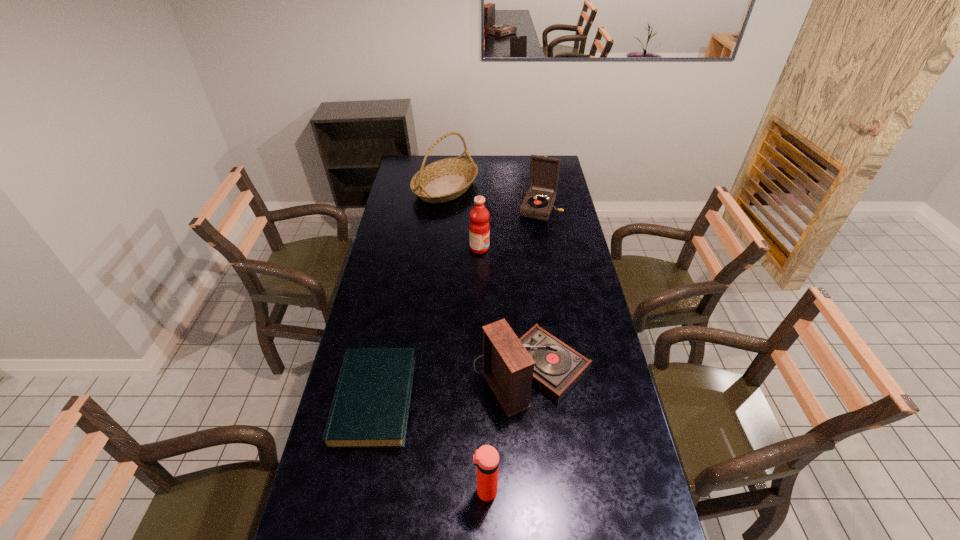
What are the coordinates of `unoccupied position between the fruit juice and the farther phonograph record` in the screenshot? It's located at (510, 228).

Locate an element on the screen. This screenshot has width=960, height=540. free area in between the book and the nearest object is located at coordinates (430, 445).

The height and width of the screenshot is (540, 960). I want to click on vacant area that lies between the book and the basket, so click(x=410, y=294).

At what (x,y) coordinates should I click in order to perform the action: click on unoccupied position between the thermos bottle and the fruit juice. Please return your answer as a coordinate pair (x, y). Looking at the image, I should click on (483, 370).

I want to click on empty space that is in between the nearer phonograph record and the book, so click(453, 386).

Where is `free spot between the book and the nearer phonograph record`? free spot between the book and the nearer phonograph record is located at coordinates click(x=453, y=386).

Point out which object is positioned as the second nearest to the nearest object. Please provide its 2D coordinates. Your answer should be formatted as a tuple, i.e. [(x, y)], where the tuple contains the x and y coordinates of a point satisfying the conditions above.

[(370, 408)]

You are a GUI agent. You are given a task and a screenshot of the screen. Output one action in this format:
    pyautogui.click(x=<x>, y=<y>)
    Task: Click on the object that ranks as the third closest to the basket
    
    Given the screenshot: What is the action you would take?
    pyautogui.click(x=511, y=365)

Where is `vacant space that satisfies the following two spatial constraints: 1. on the front label of the fruit juice; 2. on the right side of the thermos bottle`? This screenshot has height=540, width=960. vacant space that satisfies the following two spatial constraints: 1. on the front label of the fruit juice; 2. on the right side of the thermos bottle is located at coordinates (479, 491).

Identify the location of free space that satisfies the following two spatial constraints: 1. on the front label of the fourth nearest object; 2. on the back side of the nearer phonograph record. (479, 372).